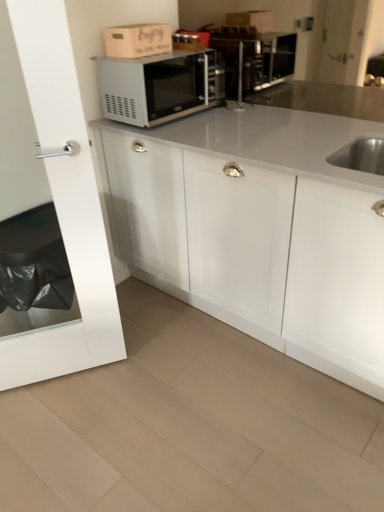
What do you see at coordinates (239, 86) in the screenshot?
I see `satin nickel faucet at center` at bounding box center [239, 86].

At what (x,y) coordinates should I click in order to perform the action: click on satin silver microwave at upper center. Please return your answer as a coordinate pair (x, y). The image size is (384, 512). Looking at the image, I should click on (157, 86).

How different are the orientations of satin nickel faucet at center and satin silver microwave at upper center in degrees?

They differ by 90 degrees in their facing directions.

From the image's perspective, is satin nickel faucet at center located above or below satin silver microwave at upper center?

satin nickel faucet at center is situated higher than satin silver microwave at upper center in the image.

Can we say satin nickel faucet at center lies outside satin silver microwave at upper center?

satin nickel faucet at center lies outside satin silver microwave at upper center's area.

Considering the sizes of objects satin nickel faucet at center and satin silver microwave at upper center in the image provided, who is smaller, satin nickel faucet at center or satin silver microwave at upper center?

Smaller between the two is satin nickel faucet at center.

Does satin nickel faucet at center appear on the left side of white matte cabinet at center?

Indeed, satin nickel faucet at center is positioned on the left side of white matte cabinet at center.

Consider the image. From a real-world perspective, is satin nickel faucet at center over white matte cabinet at center?

Yes.

Is satin nickel faucet at center facing towards white matte cabinet at center?

No, satin nickel faucet at center is not turned towards white matte cabinet at center.

Can you confirm if satin nickel faucet at center is taller than white matte cabinet at center?

Incorrect, the height of satin nickel faucet at center is not larger of that of white matte cabinet at center.

Visually, is satin nickel faucet at center positioned to the left or to the right of wooden cardboard box at upper center?

satin nickel faucet at center is to the right of wooden cardboard box at upper center.

Which is correct: satin nickel faucet at center is inside wooden cardboard box at upper center, or outside of it?

satin nickel faucet at center lies outside wooden cardboard box at upper center.

Between satin nickel faucet at center and wooden cardboard box at upper center, which one has smaller width?

With smaller width is satin nickel faucet at center.

From the image's perspective, relative to wooden cardboard box at upper center, is satin nickel faucet at center above or below?

From the image's perspective, satin nickel faucet at center appears below wooden cardboard box at upper center.

Considering the sizes of wooden cardboard box at upper center and white matte cabinet at center in the image, is wooden cardboard box at upper center taller or shorter than white matte cabinet at center?

wooden cardboard box at upper center is shorter than white matte cabinet at center.

From a real-world perspective, is wooden cardboard box at upper center physically located above or below white matte cabinet at center?

wooden cardboard box at upper center is above white matte cabinet at center.

Is wooden cardboard box at upper center turned away from white matte cabinet at center?

No, wooden cardboard box at upper center is not facing away from white matte cabinet at center.

Is wooden cardboard box at upper center not near white matte cabinet at center?

No.

Is point (157, 55) behind point (68, 69)?

Yes.

Locate an element on the screen. The image size is (384, 512). glass door in front of the satin silver microwave at upper center is located at coordinates (64, 206).

From the picture: Relative to transparent glass door at left, is satin silver microwave at upper center in front or behind?

Visually, satin silver microwave at upper center is located behind transparent glass door at left.

Considering the sizes of objects satin silver microwave at upper center and transparent glass door at left in the image provided, who is wider, satin silver microwave at upper center or transparent glass door at left?

satin silver microwave at upper center.

Is white matte cabinet at center surrounding wooden cardboard box at upper center?

Actually, wooden cardboard box at upper center is outside white matte cabinet at center.

Is point (158, 252) more distant than point (113, 54)?

Yes, point (158, 252) is farther from viewer.

Is white matte cabinet at center oriented away from wooden cardboard box at upper center?

No.

Consider the image. How distant is white matte cabinet at center from wooden cardboard box at upper center?

They are 30.24 inches apart.

Is transparent glass door at left aimed at white matte cabinet at center?

No, transparent glass door at left is not turned towards white matte cabinet at center.

Does transparent glass door at left appear on the right side of white matte cabinet at center?

In fact, transparent glass door at left is to the left of white matte cabinet at center.

In terms of height, does transparent glass door at left look taller or shorter compared to white matte cabinet at center?

transparent glass door at left is taller than white matte cabinet at center.

What are the coordinates of `microwave oven to the left of satin nickel faucet at center` in the screenshot? It's located at (157, 86).

The height and width of the screenshot is (512, 384). Identify the location of faucet lying above the white matte cabinet at center (from the image's perspective). (239, 86).

Based on their spatial positions, is white matte cabinet at center or satin silver microwave at upper center closer to satin nickel faucet at center?

Among the two, satin silver microwave at upper center is located nearer to satin nickel faucet at center.

Based on their spatial positions, is satin nickel faucet at center or white matte cabinet at center further from transparent glass door at left?

satin nickel faucet at center is positioned further to the anchor transparent glass door at left.

When comparing their distances from white matte cabinet at center, does satin silver microwave at upper center or satin nickel faucet at center seem closer?

satin silver microwave at upper center is positioned closer to the anchor white matte cabinet at center.

When comparing their distances from white matte cabinet at center, does satin nickel faucet at center or satin silver microwave at upper center seem closer?

satin silver microwave at upper center.

Considering their positions, is satin silver microwave at upper center positioned closer to wooden cardboard box at upper center than transparent glass door at left?

satin silver microwave at upper center.

Estimate the real-world distances between objects in this image. Which object is closer to transparent glass door at left, white matte cabinet at center or satin nickel faucet at center?

white matte cabinet at center lies closer to transparent glass door at left than the other object.

Which object lies nearer to the anchor point satin silver microwave at upper center, wooden cardboard box at upper center or satin nickel faucet at center?

wooden cardboard box at upper center.

Estimate the real-world distances between objects in this image. Which object is closer to white matte cabinet at center, transparent glass door at left or wooden cardboard box at upper center?

transparent glass door at left is positioned closer to the anchor white matte cabinet at center.

Where is `faucet between wooden cardboard box at upper center and transparent glass door at left vertically`? faucet between wooden cardboard box at upper center and transparent glass door at left vertically is located at coordinates (239, 86).

You are a GUI agent. You are given a task and a screenshot of the screen. Output one action in this format:
    pyautogui.click(x=<x>, y=<y>)
    Task: Click on the microwave oven that lies between wooden cardboard box at upper center and white matte cabinet at center from top to bottom
    The height and width of the screenshot is (512, 384).
    Given the screenshot: What is the action you would take?
    pyautogui.click(x=157, y=86)

At what (x,y) coordinates should I click in order to perform the action: click on microwave oven that lies between satin nickel faucet at center and white matte cabinet at center from top to bottom. Please return your answer as a coordinate pair (x, y). The height and width of the screenshot is (512, 384). Looking at the image, I should click on (157, 86).

I want to click on microwave oven between transparent glass door at left and satin nickel faucet at center from front to back, so click(x=157, y=86).